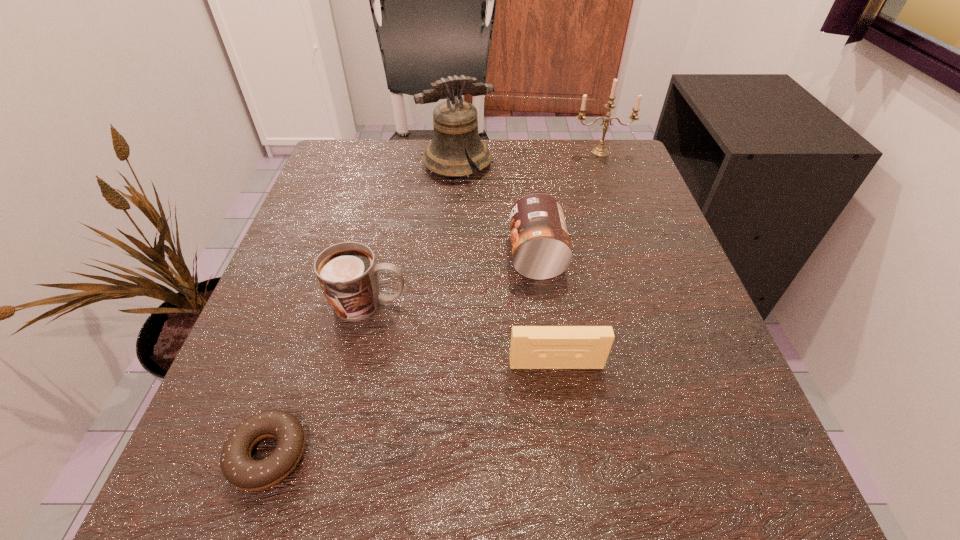
Where is `free area in between the bell and the can`? Image resolution: width=960 pixels, height=540 pixels. free area in between the bell and the can is located at coordinates (497, 210).

Where is `empty location between the videotape and the mug`? The image size is (960, 540). empty location between the videotape and the mug is located at coordinates (463, 334).

Where is `free spot between the bell and the third farthest object`? free spot between the bell and the third farthest object is located at coordinates (497, 210).

Find the location of `vacant space in between the nearest object and the can`. vacant space in between the nearest object and the can is located at coordinates (402, 355).

Where is `unoccupied position between the fifth farthest object and the third nearest object`? This screenshot has width=960, height=540. unoccupied position between the fifth farthest object and the third nearest object is located at coordinates (463, 334).

The height and width of the screenshot is (540, 960). Identify the location of free area in between the candle and the shortest object. (435, 303).

This screenshot has width=960, height=540. In order to click on free area in between the doughnut and the videotape in this screenshot , I will do click(x=413, y=409).

The image size is (960, 540). I want to click on vacant area between the bell and the fourth farthest object, so click(x=413, y=234).

Identify which object is the nearest to the third nearest object. Please provide its 2D coordinates. Your answer should be formatted as a tuple, i.e. [(x, y)], where the tuple contains the x and y coordinates of a point satisfying the conditions above.

[(243, 472)]

Identify the location of object that ranks as the fourth closest to the fourth farthest object. This screenshot has height=540, width=960. (455, 122).